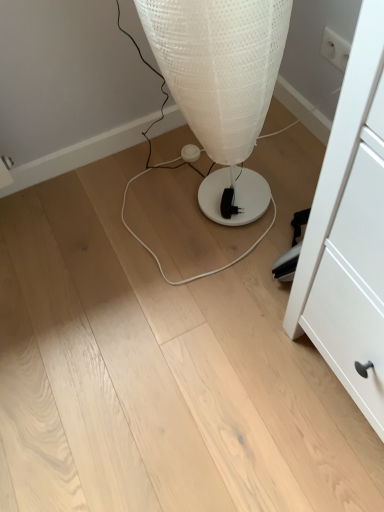
This screenshot has width=384, height=512. What are the coordinates of `vacant region below white matte lamp at center (from a real-world perspective)` in the screenshot? It's located at (203, 208).